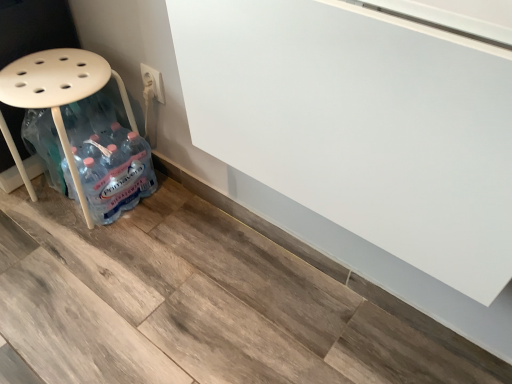
Question: Is white plastic stool at left at the back of white plastic electric outlet at upper center?

Choices:
 (A) no
 (B) yes

Answer: (A)

Question: From the image's perspective, would you say white plastic electric outlet at upper center is positioned over white plastic stool at left?

Choices:
 (A) no
 (B) yes

Answer: (B)

Question: Is the depth of white plastic electric outlet at upper center less than that of white plastic stool at left?

Choices:
 (A) no
 (B) yes

Answer: (A)

Question: Does white plastic electric outlet at upper center appear on the left side of white plastic stool at left?

Choices:
 (A) yes
 (B) no

Answer: (B)

Question: Can white plastic stool at left be found inside white plastic electric outlet at upper center?

Choices:
 (A) yes
 (B) no

Answer: (B)

Question: Does white plastic electric outlet at upper center have a greater width compared to white plastic stool at left?

Choices:
 (A) yes
 (B) no

Answer: (B)

Question: Is white plastic stool at left beside white plastic electric outlet at upper center?

Choices:
 (A) no
 (B) yes

Answer: (A)

Question: Is white plastic stool at left taller than white plastic electric outlet at upper center?

Choices:
 (A) no
 (B) yes

Answer: (B)

Question: Is white plastic stool at left located outside white plastic electric outlet at upper center?

Choices:
 (A) yes
 (B) no

Answer: (A)

Question: Is white plastic stool at left positioned before white plastic electric outlet at upper center?

Choices:
 (A) no
 (B) yes

Answer: (B)

Question: Can you confirm if white plastic stool at left is wider than white plastic electric outlet at upper center?

Choices:
 (A) no
 (B) yes

Answer: (B)

Question: From a real-world perspective, is white plastic stool at left located higher than white plastic electric outlet at upper center?

Choices:
 (A) no
 (B) yes

Answer: (A)

Question: From the image's perspective, relative to white plastic electric outlet at upper center, is white plastic stool at left above or below?

Choices:
 (A) below
 (B) above

Answer: (A)